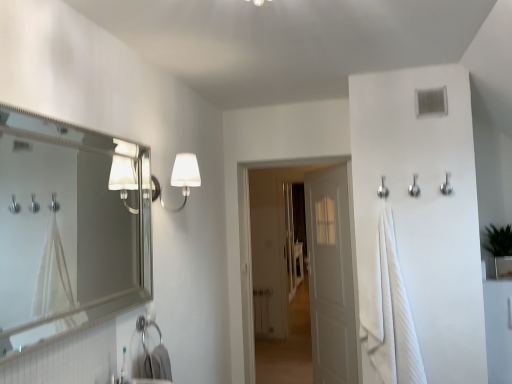
Locate an element on the screen. This screenshot has width=512, height=384. white matte door at center, positioned as the first door in back-to-front order is located at coordinates (331, 276).

This screenshot has width=512, height=384. What do you see at coordinates (446, 185) in the screenshot? I see `silver metallic hook at upper right, the first shower viewed from the right` at bounding box center [446, 185].

Based on the photo, what is the approximate width of white plastic vent at upper right?

white plastic vent at upper right is 1.07 inches wide.

Find the location of `white fabric lampshade at upper center`. white fabric lampshade at upper center is located at coordinates (180, 179).

At what (x,y) coordinates should I click in order to perform the action: click on white plastic toothbrush at lower left. Please return your answer as a coordinate pair (x, y). The width and height of the screenshot is (512, 384). Looking at the image, I should click on (124, 369).

How different are the orientations of white matte door at center, positioned as the first door in back-to-front order, and silver metallic shower at upper right, the third shower from the right, in degrees?

white matte door at center, positioned as the first door in back-to-front order, and silver metallic shower at upper right, the third shower from the right, are facing 58.7 degrees away from each other.

Considering the sizes of objects white matte door at center, positioned as the first door in back-to-front order, and silver metallic shower at upper right, the third shower from the right, in the image provided, who is wider, white matte door at center, positioned as the first door in back-to-front order, or silver metallic shower at upper right, the third shower from the right,?

Wider between the two is white matte door at center, positioned as the first door in back-to-front order.

Does white matte door at center, positioned as the first door in back-to-front order, appear on the right side of silver metallic shower at upper right, the 1th shower in the left-to-right sequence?

No, white matte door at center, positioned as the first door in back-to-front order, is not to the right of silver metallic shower at upper right, the 1th shower in the left-to-right sequence.

Is there a large distance between white matte door at center, positioned as the first door in back-to-front order, and silver metallic shower at upper right, the 1th shower in the left-to-right sequence?

A: white matte door at center, positioned as the first door in back-to-front order, is positioned a significant distance from silver metallic shower at upper right, the 1th shower in the left-to-right sequence.

From the picture: Does white cotton bath towel at right have a smaller size compared to silver/metallic mirror at left?

No.

Is white cotton bath towel at right looking in the opposite direction of silver/metallic mirror at left?

No, silver/metallic mirror at left is not at the back of white cotton bath towel at right.

How distant is white cotton bath towel at right from silver/metallic mirror at left?

white cotton bath towel at right is 2.09 meters away from silver/metallic mirror at left.

Is white cotton bath towel at right closer to the viewer compared to silver/metallic mirror at left?

No, it is behind silver/metallic mirror at left.

From a real-world perspective, is silver/metallic mirror at left on silver metallic hook at upper right, acting as the 3th shower starting from the left?

Actually, silver/metallic mirror at left is physically below silver metallic hook at upper right, acting as the 3th shower starting from the left, in the real world.

Looking at this image, does silver/metallic mirror at left appear on the left side of silver metallic hook at upper right, the first shower viewed from the right?

Yes, silver/metallic mirror at left is to the left of silver metallic hook at upper right, the first shower viewed from the right.

Does silver/metallic mirror at left have a larger size compared to silver metallic hook at upper right, acting as the 3th shower starting from the left?

Yes.

Does white matte door at center, which is the second door from front to back, appear on the right side of silver metallic hook at upper right, which ranks as the second shower in right-to-left order?

Incorrect, white matte door at center, which is the second door from front to back, is not on the right side of silver metallic hook at upper right, which ranks as the second shower in right-to-left order.

Is white matte door at center, positioned as the first door in back-to-front order, taller or shorter than silver metallic hook at upper right, which ranks as the second shower in right-to-left order?

white matte door at center, positioned as the first door in back-to-front order, is taller than silver metallic hook at upper right, which ranks as the second shower in right-to-left order.

Consider the image. Considering the sizes of objects white matte door at center, positioned as the first door in back-to-front order, and silver metallic hook at upper right, which ranks as the second shower in right-to-left order, in the image provided, who is smaller, white matte door at center, positioned as the first door in back-to-front order, or silver metallic hook at upper right, which ranks as the second shower in right-to-left order,?

With smaller size is silver metallic hook at upper right, which ranks as the second shower in right-to-left order.

Does white matte door at center, which is the second door from front to back, turn towards silver metallic hook at upper right, which ranks as the second shower in right-to-left order?

No, white matte door at center, which is the second door from front to back, is not turned towards silver metallic hook at upper right, which ranks as the second shower in right-to-left order.

From a real-world perspective, which object rests below the other?

white wooden door at center, the 1th door in the front-to-back sequence, is physically lower.

Can you tell me how much silver metallic shower at upper right, the 1th shower in the left-to-right sequence, and white wooden door at center, which ranks as the 2th door in back-to-front order, differ in facing direction?

There is a 0.396-degree angle between the facing directions of silver metallic shower at upper right, the 1th shower in the left-to-right sequence, and white wooden door at center, which ranks as the 2th door in back-to-front order.

In order to click on the 1st door behind the silver metallic shower at upper right, the third shower from the right in this screenshot , I will do `click(250, 228)`.

Measure the distance between silver metallic shower at upper right, the third shower from the right, and white wooden door at center, the 1th door in the front-to-back sequence.

silver metallic shower at upper right, the third shower from the right, is 3.54 meters from white wooden door at center, the 1th door in the front-to-back sequence.

From a real-world perspective, who is located higher, white wooden door at center, the 1th door in the front-to-back sequence, or white fabric lampshade at upper center?

In real-world perspective, white fabric lampshade at upper center is above.

Considering the positions of points (249, 312) and (183, 178), is point (249, 312) closer to camera compared to point (183, 178)?

No, (249, 312) is behind (183, 178).

How far apart are white wooden door at center, which ranks as the 2th door in back-to-front order, and white fabric lampshade at upper center?

3.74 meters.

Is white wooden door at center, which ranks as the 2th door in back-to-front order, in front of white fabric lampshade at upper center?

No, it is not.

Is white fabric lampshade at upper center a part of white cotton bath towel at right?

That's incorrect, white fabric lampshade at upper center is not inside white cotton bath towel at right.

Consider the image. Considering their positions, is white cotton bath towel at right located in front of or behind white fabric lampshade at upper center?

white cotton bath towel at right is behind white fabric lampshade at upper center.

I want to click on bath towel below the white fabric lampshade at upper center (from a real-world perspective), so click(393, 316).

Which door is the 2nd one when counting from the back of the silver metallic shower at upper right, the 1th shower in the left-to-right sequence? Please provide its 2D coordinates.

[(331, 276)]

There is a white cotton bath towel at right. Where is `mirror above it (from a real-world perspective)`? The image size is (512, 384). mirror above it (from a real-world perspective) is located at coordinates (61, 235).

Based on their spatial positions, is white plastic toothbrush at lower left or white wooden door at center, the 1th door in the front-to-back sequence, further from white plastic vent at upper right?

white wooden door at center, the 1th door in the front-to-back sequence, lies further to white plastic vent at upper right than the other object.

Considering their positions, is white wooden door at center, which ranks as the 2th door in back-to-front order, positioned closer to silver metallic shower at upper right, the 1th shower in the left-to-right sequence, than white fabric lampshade at upper center?

Among the two, white fabric lampshade at upper center is located nearer to silver metallic shower at upper right, the 1th shower in the left-to-right sequence.

Which object lies further to the anchor point white plastic toothbrush at lower left, silver metallic shower at upper right, the third shower from the right, or white fabric lampshade at upper center?

Based on the image, silver metallic shower at upper right, the third shower from the right, appears to be further to white plastic toothbrush at lower left.

When comparing their distances from silver metallic hook at upper right, the first shower viewed from the right, does white plastic toothbrush at lower left or silver metallic hook at upper right, which is the 2th shower in left-to-right order, seem closer?

Based on the image, silver metallic hook at upper right, which is the 2th shower in left-to-right order, appears to be nearer to silver metallic hook at upper right, the first shower viewed from the right.

Looking at the image, which one is located further to silver/metallic mirror at left, white wooden door at center, which ranks as the 2th door in back-to-front order, or white matte door at center, which is the second door from front to back?

Based on the image, white wooden door at center, which ranks as the 2th door in back-to-front order, appears to be further to silver/metallic mirror at left.

Based on their spatial positions, is silver metallic hook at upper right, acting as the 3th shower starting from the left, or white fabric lampshade at upper center closer to white wooden door at center, which ranks as the 2th door in back-to-front order?

silver metallic hook at upper right, acting as the 3th shower starting from the left.

Looking at the image, which one is located closer to white cotton bath towel at right, white fabric lampshade at upper center or silver metallic shower at upper right, the 1th shower in the left-to-right sequence?

silver metallic shower at upper right, the 1th shower in the left-to-right sequence, is positioned closer to the anchor white cotton bath towel at right.

When comparing their distances from white plastic vent at upper right, does white cotton bath towel at right or silver metallic shower at upper right, the third shower from the right, seem closer?

The object closer to white plastic vent at upper right is silver metallic shower at upper right, the third shower from the right.

What are the coordinates of `window between silver/metallic mirror at left and white wooden door at center, which ranks as the 2th door in back-to-front order, from front to back` in the screenshot? It's located at (431, 102).

I want to click on window between silver/metallic mirror at left and silver metallic hook at upper right, the first shower viewed from the right, from left to right, so click(431, 102).

Find the location of a particular element. The height and width of the screenshot is (384, 512). fixture located between white plastic toothbrush at lower left and silver metallic hook at upper right, acting as the 3th shower starting from the left, in the left-right direction is located at coordinates (180, 179).

In order to click on shower located between silver/metallic mirror at left and silver metallic hook at upper right, which is the 2th shower in left-to-right order, in the left-right direction in this screenshot , I will do `click(383, 189)`.